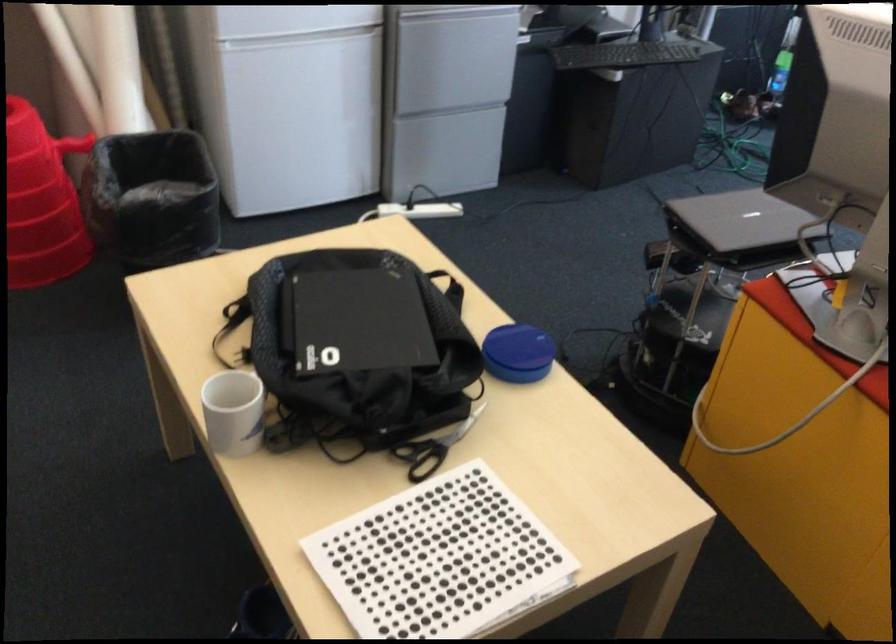
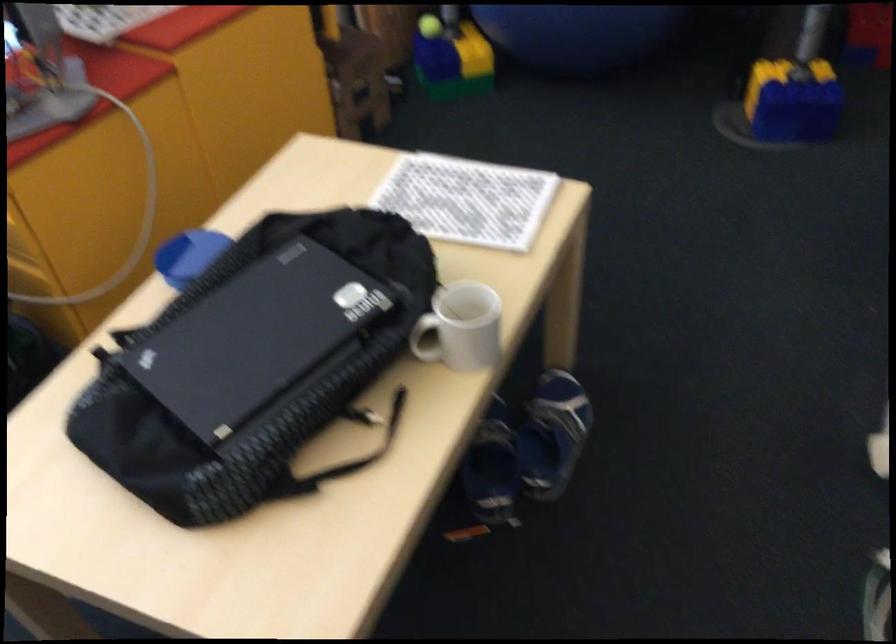
In the second image, find the point that corresponds to [299,422] in the first image.

(426, 339)